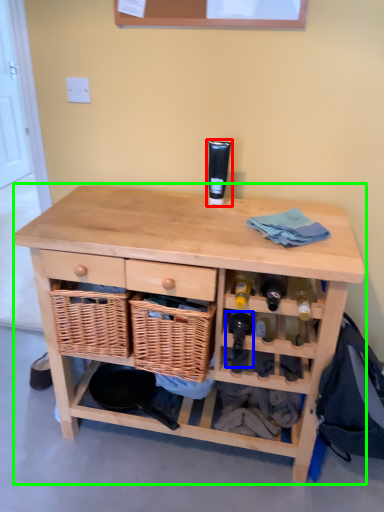
Question: Based on their relative distances, which object is farther from toiletry (highlighted by a red box)? Choose from wine bottle (highlighted by a blue box) and table (highlighted by a green box).

Choices:
 (A) wine bottle
 (B) table

Answer: (A)